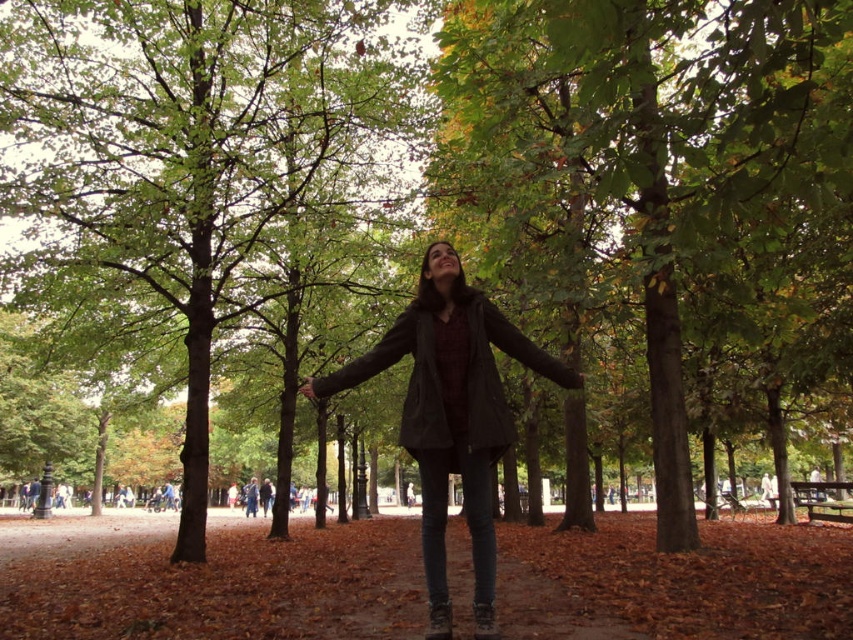
Question: Which is farther from the green matte tree at center?

Choices:
 (A) matte black jacket at center
 (B) dark gray matte jacket at center

Answer: (B)

Question: Does green leafy tree at center appear over dark gray matte jacket at center?

Choices:
 (A) no
 (B) yes

Answer: (B)

Question: Which is farther from the green matte tree at center?

Choices:
 (A) dark gray matte jacket at center
 (B) green leafy tree at center
 (C) matte black jacket at center

Answer: (B)

Question: Can you confirm if green leafy tree at center is positioned above dark gray matte jacket at center?

Choices:
 (A) yes
 (B) no

Answer: (A)

Question: Which point appears closest to the camera in this image?

Choices:
 (A) (184, 150)
 (B) (431, 332)

Answer: (B)

Question: Can you confirm if green leafy tree at center is bigger than dark gray matte jacket at center?

Choices:
 (A) yes
 (B) no

Answer: (B)